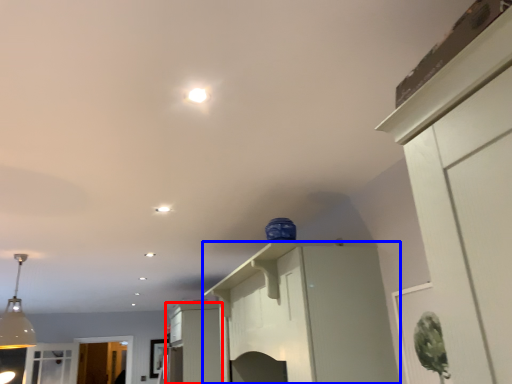
Question: Which of the following is the farthest to the observer, cabinetry (highlighted by a red box) or cabinetry (highlighted by a blue box)?

Choices:
 (A) cabinetry
 (B) cabinetry

Answer: (A)